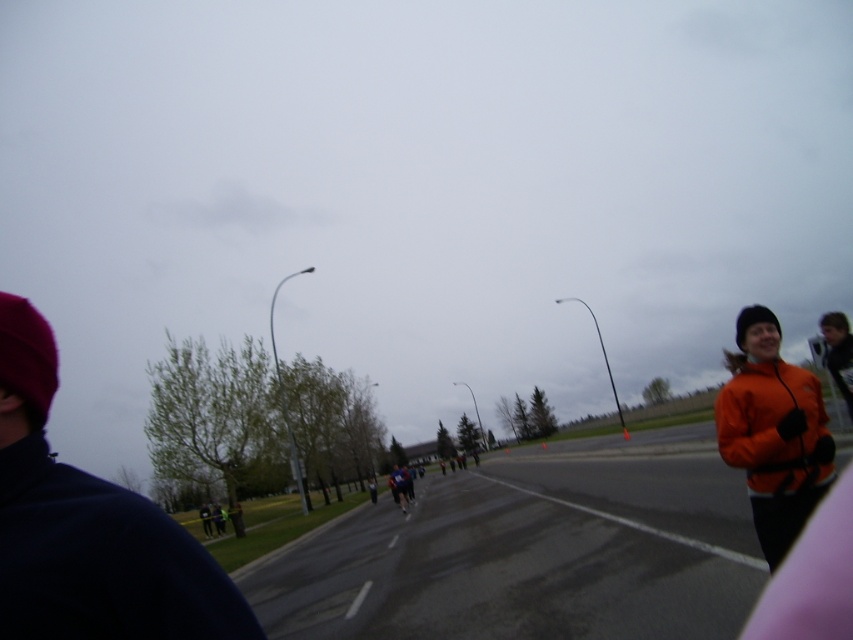
Does orange fleece jacket at right appear under orange jacket at right?

Yes.

Can you confirm if orange fleece jacket at right is positioned above orange jacket at right?

No.

Does point (759, 371) lie in front of point (827, 317)?

Yes, it is.

The image size is (853, 640). I want to click on orange fleece jacket at right, so click(x=773, y=433).

Does dark blue jacket at left appear over orange jacket at right?

Actually, dark blue jacket at left is below orange jacket at right.

Locate an element on the screen. The image size is (853, 640). dark blue jacket at left is located at coordinates (88, 529).

Is dark blue jacket at left further to the viewer compared to orange fleece jacket at right?

No, dark blue jacket at left is closer to the viewer.

Does point (15, 504) lie in front of point (762, 371)?

Yes, it is in front of point (762, 371).

Which is behind, point (44, 554) or point (764, 490)?

Point (764, 490)

Image resolution: width=853 pixels, height=640 pixels. What are the coordinates of `dark blue jacket at left` in the screenshot? It's located at (88, 529).